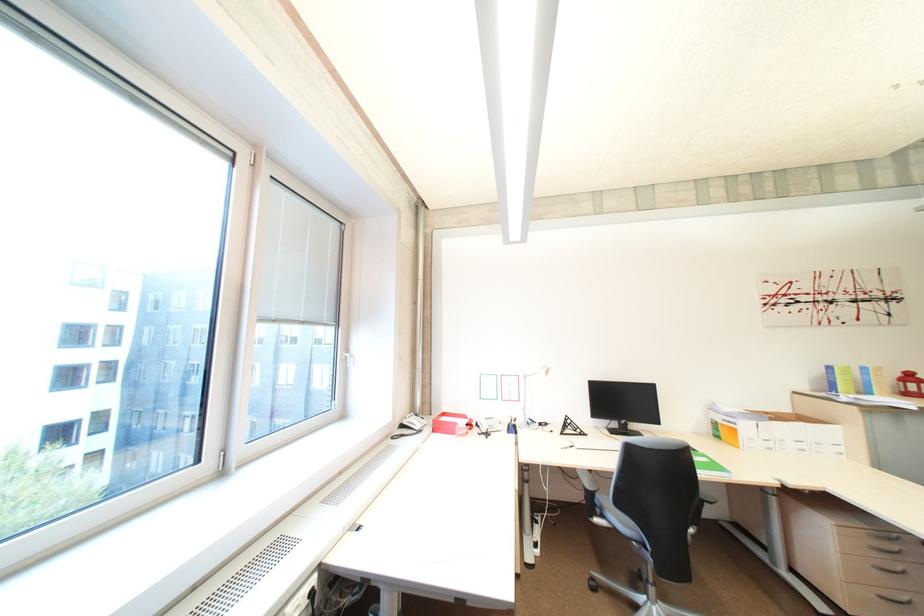
Describe the element at coordinates (590, 480) in the screenshot. I see `the chair armrest` at that location.